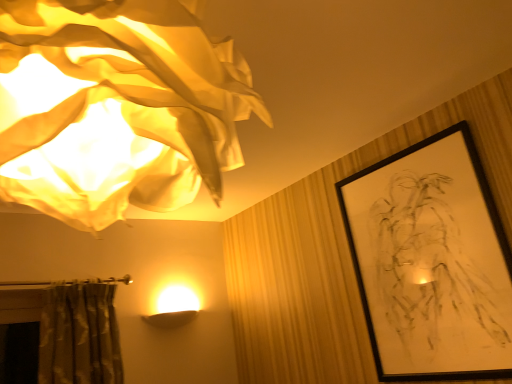
Question: Visually, is black matte picture frame at upper right positioned to the left or to the right of matte white fabric lampshade at upper left?

Choices:
 (A) left
 (B) right

Answer: (B)

Question: From a real-world perspective, is black matte picture frame at upper right positioned above or below matte white fabric lampshade at upper left?

Choices:
 (A) below
 (B) above

Answer: (A)

Question: Is black matte picture frame at upper right taller or shorter than matte white fabric lampshade at upper left?

Choices:
 (A) tall
 (B) short

Answer: (A)

Question: Is matte white fabric lampshade at upper left in front of or behind black matte picture frame at upper right in the image?

Choices:
 (A) front
 (B) behind

Answer: (A)

Question: From a real-world perspective, relative to black matte picture frame at upper right, is matte white fabric lampshade at upper left vertically above or below?

Choices:
 (A) below
 (B) above

Answer: (B)

Question: Is matte white fabric lampshade at upper left to the left or to the right of black matte picture frame at upper right in the image?

Choices:
 (A) left
 (B) right

Answer: (A)

Question: Looking at their shapes, would you say matte white fabric lampshade at upper left is wider or thinner than black matte picture frame at upper right?

Choices:
 (A) wide
 (B) thin

Answer: (A)